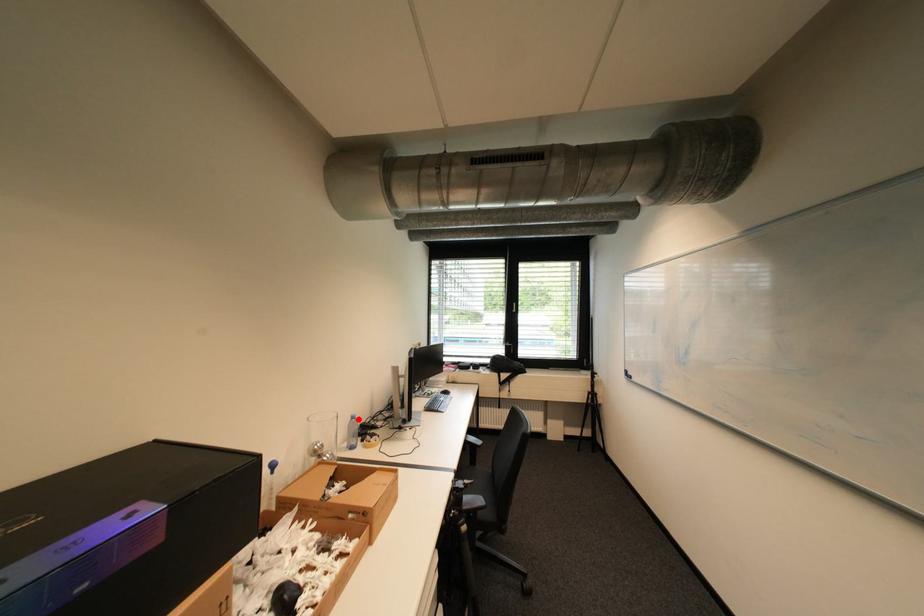
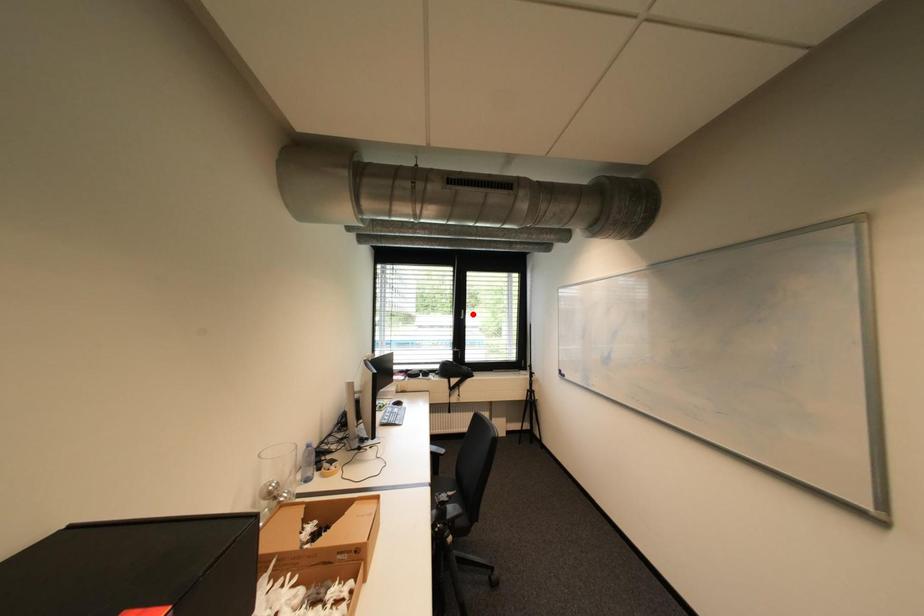
I am providing you with two images of the same scene from different viewpoints. A red point is marked on the first image and another point is marked on the second image. Is the red point in image1 aligned with the point shown in image2?

No